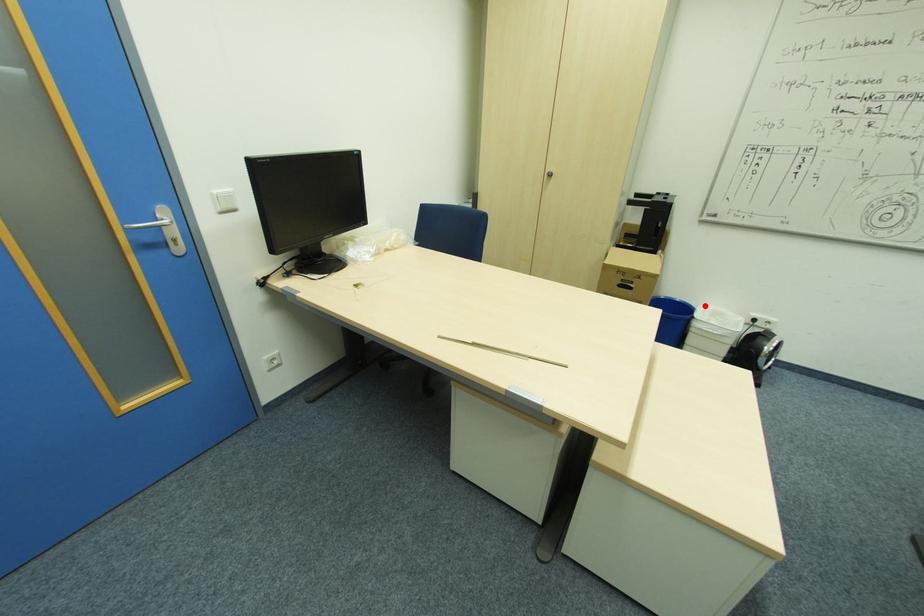
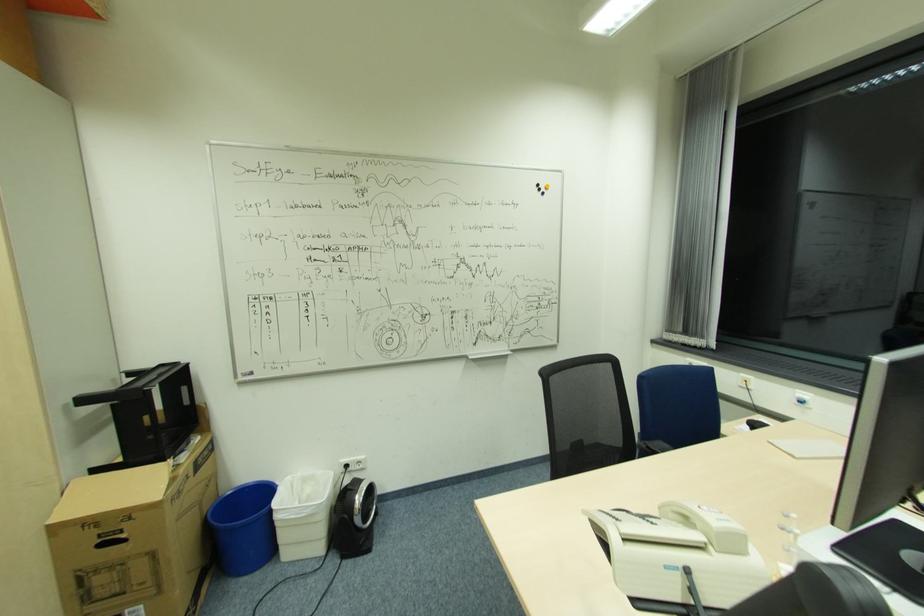
Question: I am providing you with two images of the same scene from different viewpoints. A red point is marked on the first image. Can you still see the location of the red point in image 2?

Choices:
 (A) Yes
 (B) No

Answer: (A)